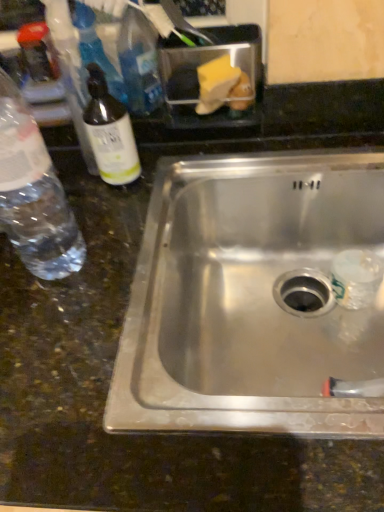
Question: Would you consider clear plastic bottle at left, which is the second bottle in right-to-left order, to be distant from stainless steel sink at center?

Choices:
 (A) yes
 (B) no

Answer: (B)

Question: Can you confirm if clear plastic bottle at left, the first bottle when ordered from left to right, is positioned to the left of stainless steel sink at center?

Choices:
 (A) yes
 (B) no

Answer: (A)

Question: Is clear plastic bottle at left, the first bottle when ordered from left to right, positioned before stainless steel sink at center?

Choices:
 (A) yes
 (B) no

Answer: (A)

Question: Could you tell me if clear plastic bottle at left, the first bottle when ordered from left to right, is facing stainless steel sink at center?

Choices:
 (A) no
 (B) yes

Answer: (A)

Question: From a real-world perspective, does clear plastic bottle at left, the first bottle when ordered from left to right, stand above stainless steel sink at center?

Choices:
 (A) yes
 (B) no

Answer: (A)

Question: In terms of size, does stainless steel sink at center appear bigger or smaller than clear plastic bottle at left, the first bottle when ordered from left to right?

Choices:
 (A) big
 (B) small

Answer: (A)

Question: Considering the positions of stainless steel sink at center and clear plastic bottle at left, which is the second bottle in right-to-left order, in the image, is stainless steel sink at center wider or thinner than clear plastic bottle at left, which is the second bottle in right-to-left order,?

Choices:
 (A) thin
 (B) wide

Answer: (B)

Question: Is stainless steel sink at center taller or shorter than clear plastic bottle at left, the first bottle when ordered from left to right?

Choices:
 (A) short
 (B) tall

Answer: (A)

Question: Does point (289, 278) appear closer or farther from the camera than point (14, 102)?

Choices:
 (A) farther
 (B) closer

Answer: (A)

Question: Considering the positions of clear glass bottle at left, acting as the second bottle starting from the left, and stainless steel sink at center in the image, is clear glass bottle at left, acting as the second bottle starting from the left, bigger or smaller than stainless steel sink at center?

Choices:
 (A) big
 (B) small

Answer: (B)

Question: From a real-world perspective, is clear glass bottle at left, which is the 1th bottle in right-to-left order, physically located above or below stainless steel sink at center?

Choices:
 (A) below
 (B) above

Answer: (B)

Question: In the image, is clear glass bottle at left, which is the 1th bottle in right-to-left order, on the left side or the right side of stainless steel sink at center?

Choices:
 (A) right
 (B) left

Answer: (B)

Question: From the image's perspective, is clear glass bottle at left, acting as the second bottle starting from the left, above or below stainless steel sink at center?

Choices:
 (A) above
 (B) below

Answer: (A)

Question: Considering their positions, is clear glass bottle at left, which is the 1th bottle in right-to-left order, located in front of or behind clear plastic bottle at left, the first bottle when ordered from left to right?

Choices:
 (A) front
 (B) behind

Answer: (B)

Question: In terms of width, does clear glass bottle at left, which is the 1th bottle in right-to-left order, look wider or thinner when compared to clear plastic bottle at left, which is the second bottle in right-to-left order?

Choices:
 (A) thin
 (B) wide

Answer: (A)